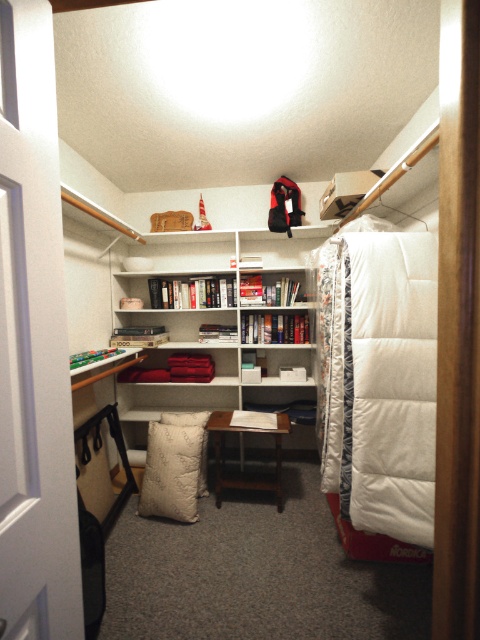
Question: Can you confirm if white matte bookcase at center is smaller than brown wooden table at center?

Choices:
 (A) no
 (B) yes

Answer: (A)

Question: Is white matte bookcase at center below brown wooden table at center?

Choices:
 (A) yes
 (B) no

Answer: (B)

Question: Which point is closer to the camera?

Choices:
 (A) white down pillow at center
 (B) white down-filled pillow at center
 (C) white matte bookcase at center

Answer: (B)

Question: Which object is the farthest from the white matte bookcase at center?

Choices:
 (A) white down-filled pillow at center
 (B) brown wooden table at center
 (C) white down pillow at center

Answer: (A)

Question: Which object appears farthest from the camera in this image?

Choices:
 (A) white down pillow at center
 (B) brown wooden table at center
 (C) white down-filled pillow at center
 (D) white matte bookcase at center

Answer: (D)

Question: In this image, where is white matte bookcase at center located relative to brown wooden table at center?

Choices:
 (A) right
 (B) left

Answer: (B)